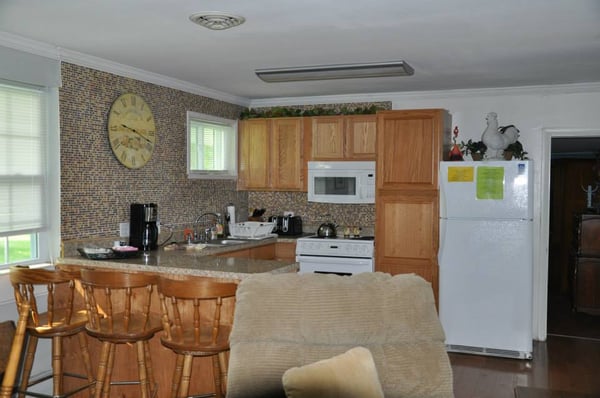
At what (x,y) coordinates should I click in order to perform the action: click on vent. Please return your answer as a coordinate pair (x, y). Looking at the image, I should click on (208, 18).